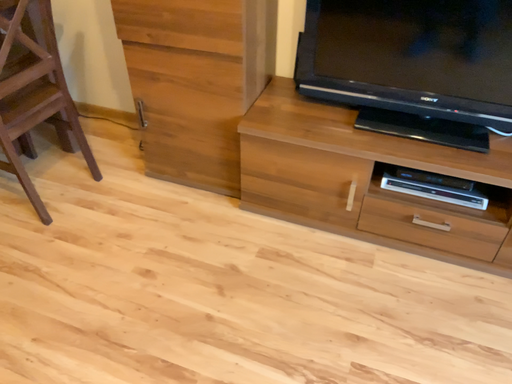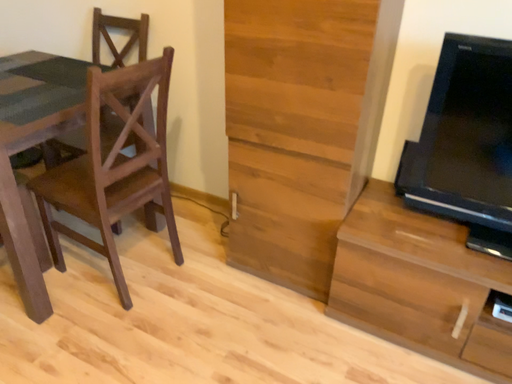
Question: Which way did the camera rotate in the video?

Choices:
 (A) rotated upward
 (B) rotated downward

Answer: (A)